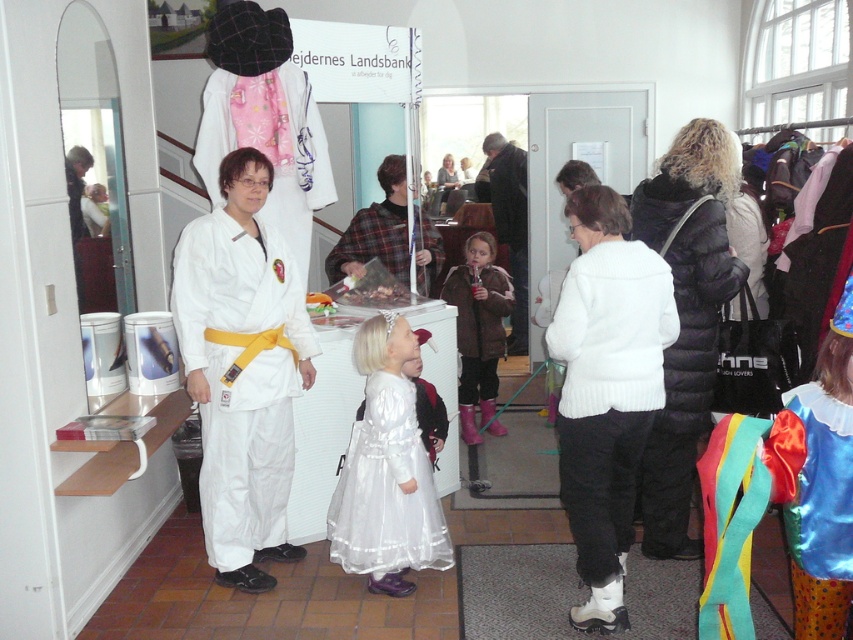
Question: Which is nearer to the white knitted sweater at center?

Choices:
 (A) white satin dress at center
 (B) silky blue dress at center
 (C) plaid fabric shirt at center
 (D) white karate uniform at center

Answer: (A)

Question: Estimate the real-world distances between objects in this image. Which object is closer to the black puffer jacket at center?

Choices:
 (A) brown fuzzy robe at center
 (B) white karate uniform at center
 (C) brown fuzzy jacket at center
 (D) plaid fabric shirt at center

Answer: (B)

Question: Can you confirm if white satin dress at center is bigger than plaid fabric shirt at center?

Choices:
 (A) yes
 (B) no

Answer: (B)

Question: Which point is closer to the camera?

Choices:
 (A) white karate uniform at center
 (B) brown fuzzy jacket at center
 (C) white knitted sweater at center
 (D) brown fuzzy robe at center

Answer: (C)

Question: Is white knitted sweater at center positioned at the back of white satin dress at center?

Choices:
 (A) no
 (B) yes

Answer: (A)

Question: Does white knitted sweater at center lie in front of silky blue dress at center?

Choices:
 (A) no
 (B) yes

Answer: (A)